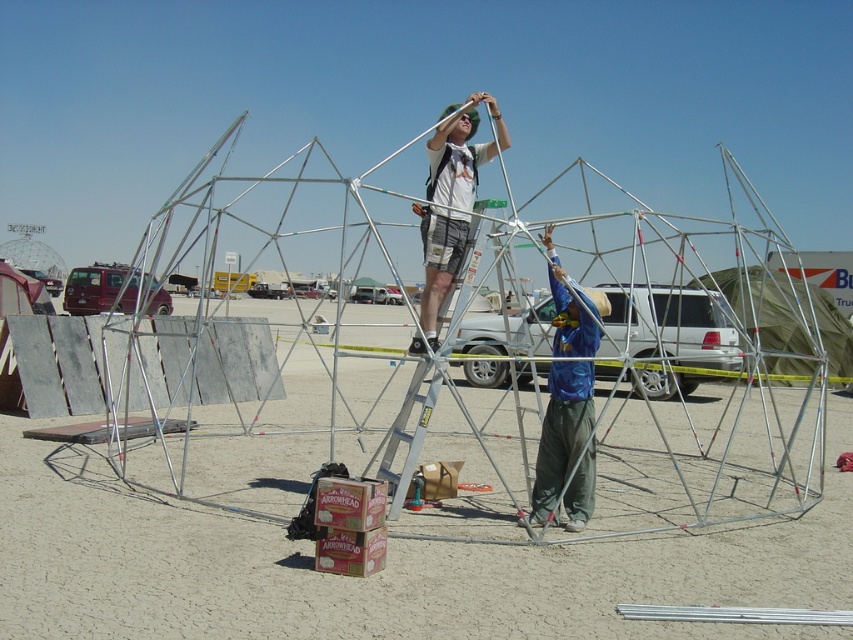
Question: Is matte white shirt at center positioned at the back of green fabric tent at center?

Choices:
 (A) yes
 (B) no

Answer: (B)

Question: Among these points, which one is farthest from the camera?

Choices:
 (A) (463, 189)
 (B) (549, 483)
 (C) (793, 280)
 (D) (498, 205)

Answer: (C)

Question: Is green fabric tent at center closer to camera compared to silver metallic ladder at center?

Choices:
 (A) yes
 (B) no

Answer: (B)

Question: Which of the following is the farthest from the observer?

Choices:
 (A) blue fabric shirt at center
 (B) matte white shirt at center

Answer: (B)

Question: Which of the following is the farthest from the observer?

Choices:
 (A) blue fabric shirt at center
 (B) matte white shirt at center
 (C) silver metallic ladder at center
 (D) green fabric tent at center

Answer: (D)

Question: Is matte white shirt at center below green fabric tent at center?

Choices:
 (A) yes
 (B) no

Answer: (B)